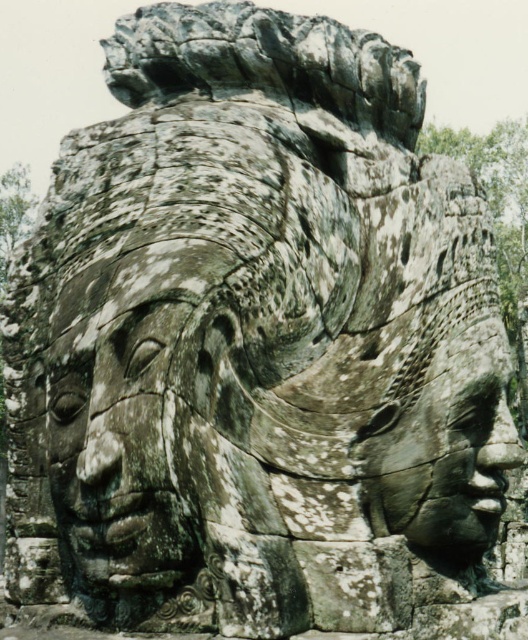
You are an archaeologist examining the large stone sculpture. You notice the gray stone face at center. Where exactly is this face positioned on the sculpture according to the coordinates provided?

The gray stone face at center is located at point coordinates of 0.648 on the x axis and 0.235 on the y axis.

You are an art conservator examining the stone sculpture. You notice two points on the sculpture marked as point 1 at coordinates (93, 400) and point 2 at coordinates (466, 540). Which point is more likely to have visible moss growth due to its position relative to the viewer?

Point 1 at coordinates (93, 400) is closer to the viewer than point 2 at coordinates (466, 540). Since moss tends to grow in areas that are less exposed to direct sunlight and more sheltered, point 1 might have more moss growth as it is in a position that is closer and possibly more shaded.